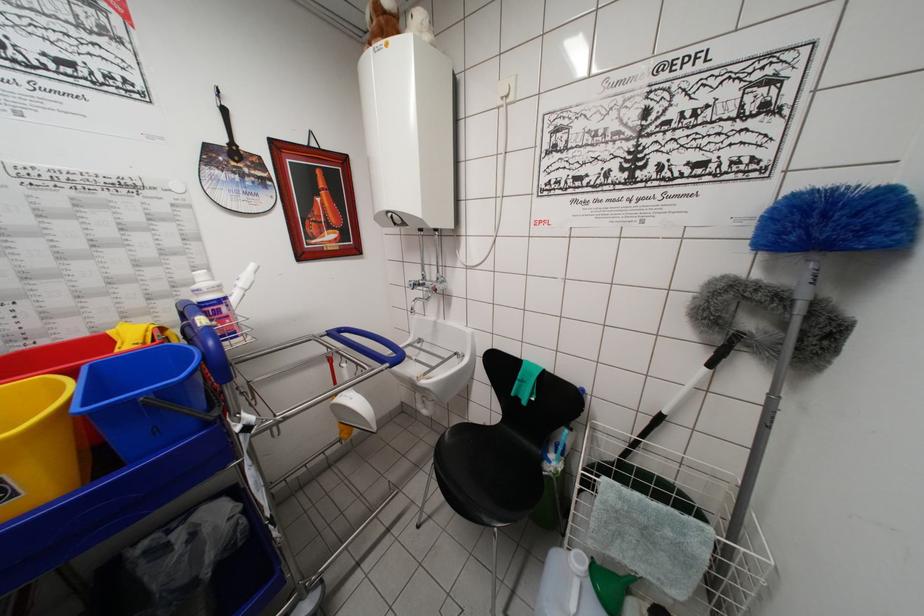
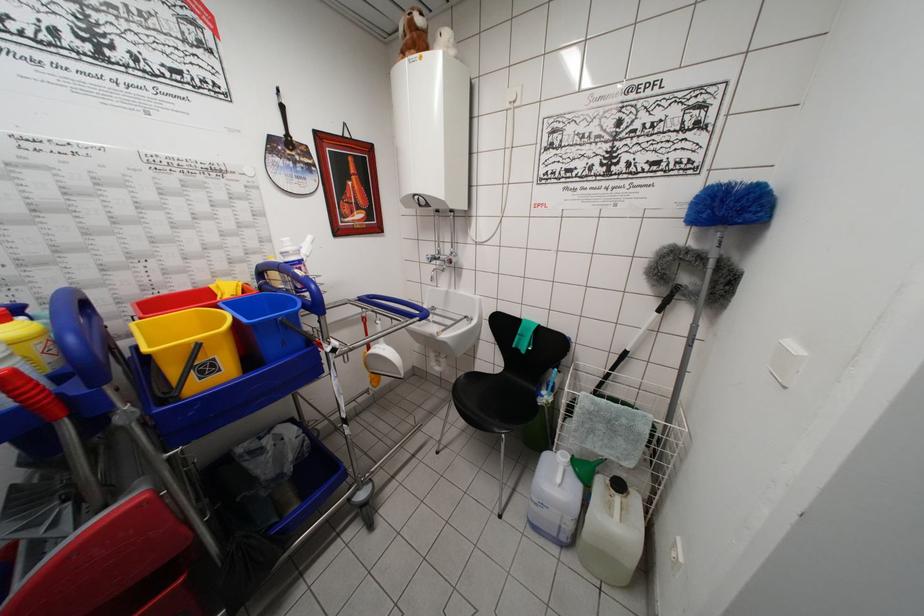
The point at (x=155, y=402) is marked in the first image. Where is the corresponding point in the second image?

(287, 323)